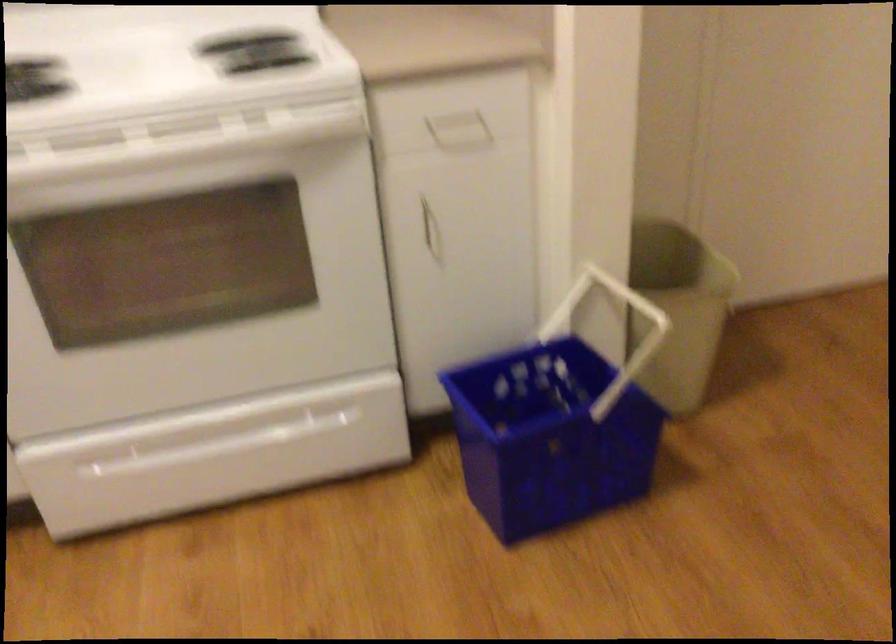
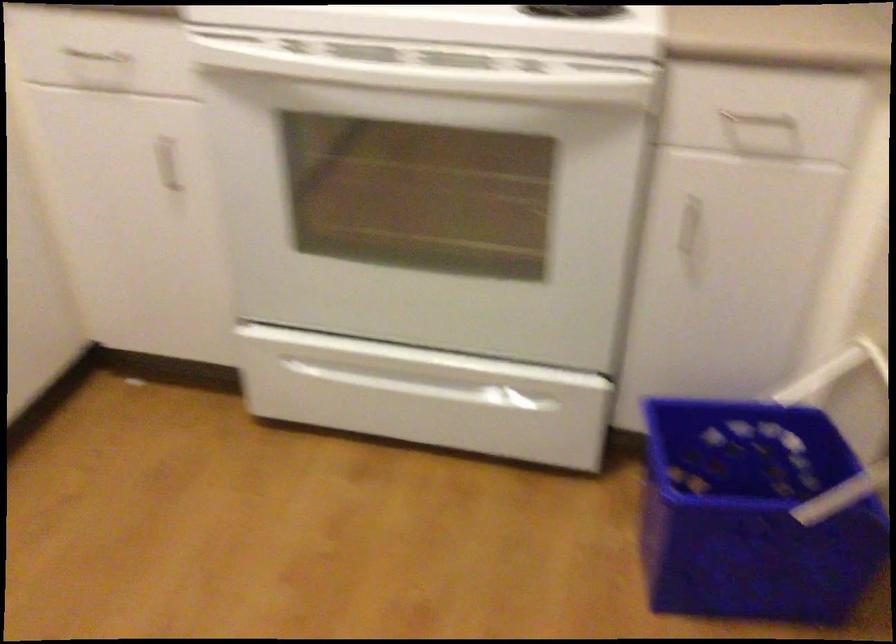
Locate, in the second image, the point that corresponds to [428,220] in the first image.

(691, 228)